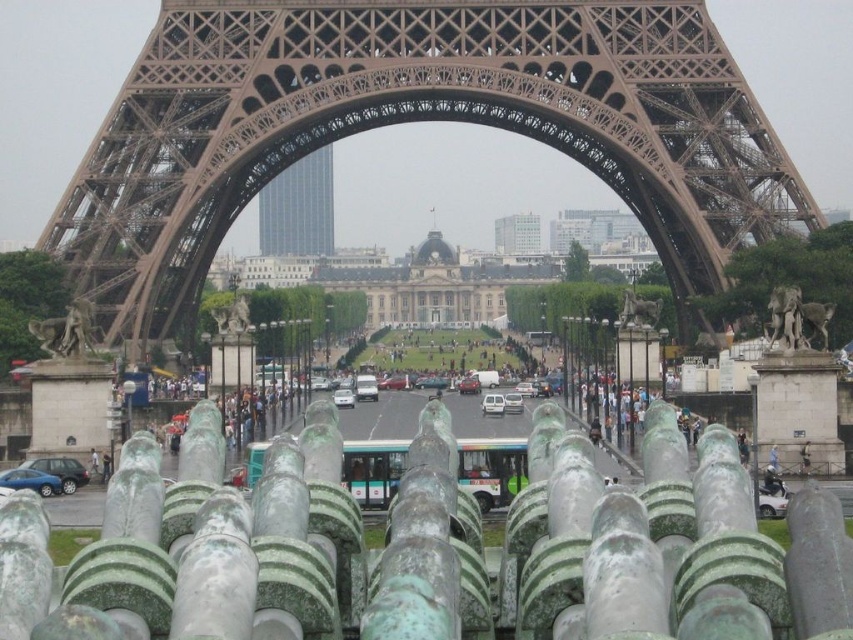
Question: Among these objects, which one is farthest from the camera?

Choices:
 (A) blue metallic car at lower left
 (B) matte silver van at center
 (C) silver metallic van at center
 (D) silver metallic car at center

Answer: (D)

Question: Does brown metal eiffel tower at center come behind glassy blue skyscraper at center?

Choices:
 (A) no
 (B) yes

Answer: (A)

Question: Can you confirm if glassy blue skyscraper at center is smaller than white matte car at center?

Choices:
 (A) no
 (B) yes

Answer: (A)

Question: Which point appears farthest from the camera in this image?

Choices:
 (A) (502, 406)
 (B) (784, 492)
 (C) (523, 406)
 (D) (332, 397)

Answer: (D)

Question: Which is farther from the brown metal eiffel tower at center?

Choices:
 (A) glassy blue skyscraper at center
 (B) matte green car at lower left

Answer: (B)

Question: From the image, what is the correct spatial relationship of glassy blue skyscraper at center in relation to white matte car at center?

Choices:
 (A) left
 (B) right

Answer: (A)